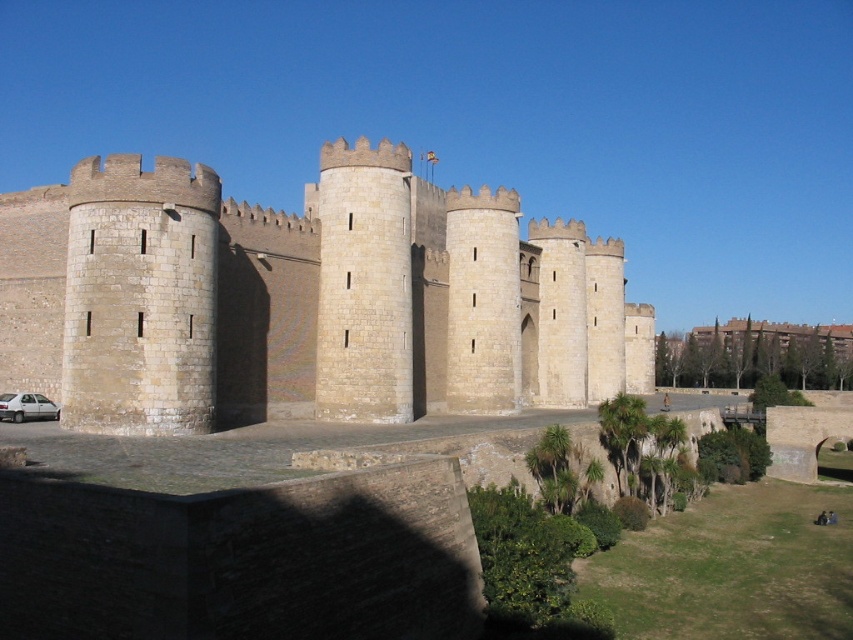
Question: Can you confirm if beige stone castle at center is positioned below silver metallic car at lower left?

Choices:
 (A) no
 (B) yes

Answer: (A)

Question: Does beige stone castle at center appear on the left side of silver metallic car at lower left?

Choices:
 (A) no
 (B) yes

Answer: (A)

Question: Is beige stone castle at center to the left of silver metallic car at lower left from the viewer's perspective?

Choices:
 (A) yes
 (B) no

Answer: (B)

Question: Which point is farther to the camera?

Choices:
 (A) silver metallic car at lower left
 (B) beige stone castle at center

Answer: (A)